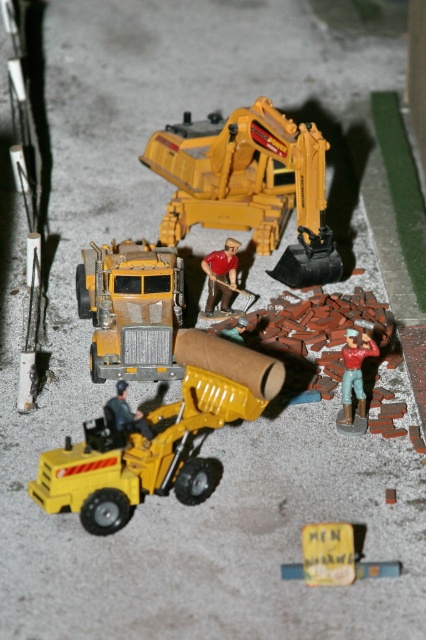
Is red shirt figure at center above metallic yellow construction worker at center?

Indeed, red shirt figure at center is positioned over metallic yellow construction worker at center.

Image resolution: width=426 pixels, height=640 pixels. Describe the element at coordinates (221, 275) in the screenshot. I see `red shirt figure at center` at that location.

Identify the location of red shirt figure at center. Image resolution: width=426 pixels, height=640 pixels. (221, 275).

Which of these two, yellow plastic excavator at center or matte yellow truck at center, stands shorter?

With less height is matte yellow truck at center.

The image size is (426, 640). Find the location of `yellow plastic excavator at center`. yellow plastic excavator at center is located at coordinates (250, 186).

Is matte yellow truck at center to the right of matte red construction worker at center right from the viewer's perspective?

Incorrect, matte yellow truck at center is not on the right side of matte red construction worker at center right.

Which of these two, matte yellow truck at center or matte red construction worker at center right, stands taller?

matte yellow truck at center is taller.

Identify the location of matte yellow truck at center. (131, 308).